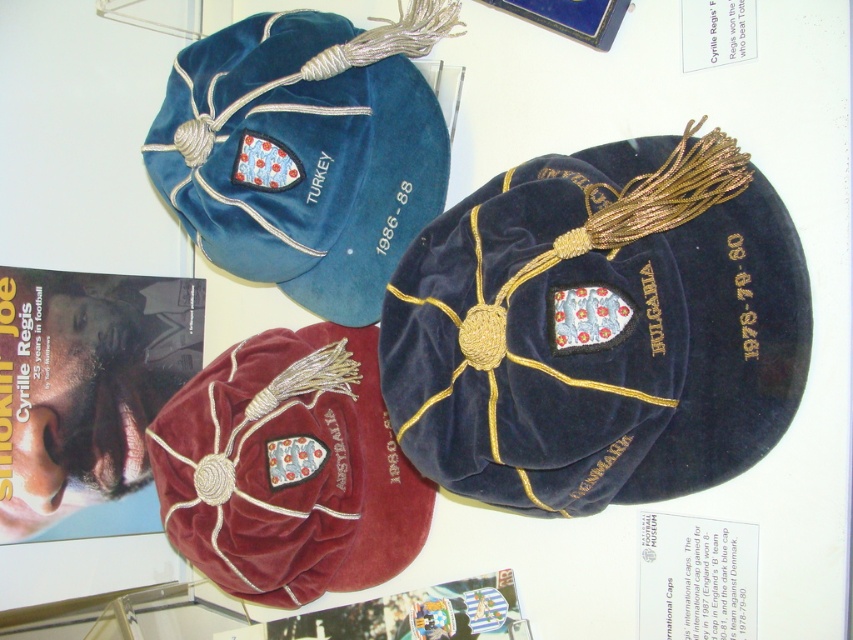
Question: Is velvet cap at center positioned before maroon velvet cap at center?

Choices:
 (A) yes
 (B) no

Answer: (A)

Question: Does velvet blue cap at upper left have a greater width compared to maroon velvet cap at center?

Choices:
 (A) no
 (B) yes

Answer: (B)

Question: Does velvet cap at center appear on the right side of maroon velvet cap at center?

Choices:
 (A) yes
 (B) no

Answer: (A)

Question: Among these objects, which one is nearest to the camera?

Choices:
 (A) velvet blue cap at upper left
 (B) maroon velvet cap at center

Answer: (A)

Question: Among these objects, which one is nearest to the camera?

Choices:
 (A) velvet blue cap at upper left
 (B) velvet cap at center
 (C) maroon velvet cap at center

Answer: (B)

Question: Which point is closer to the camera taking this photo?

Choices:
 (A) (589, 195)
 (B) (355, 458)
 (C) (364, 83)

Answer: (A)